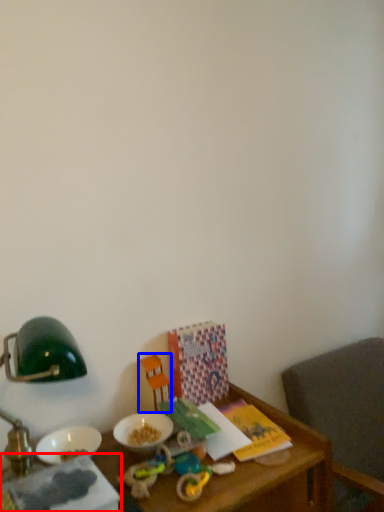
Question: Which object is closer to the camera taking this photo, book (highlighted by a red box) or toy (highlighted by a blue box)?

Choices:
 (A) book
 (B) toy

Answer: (A)